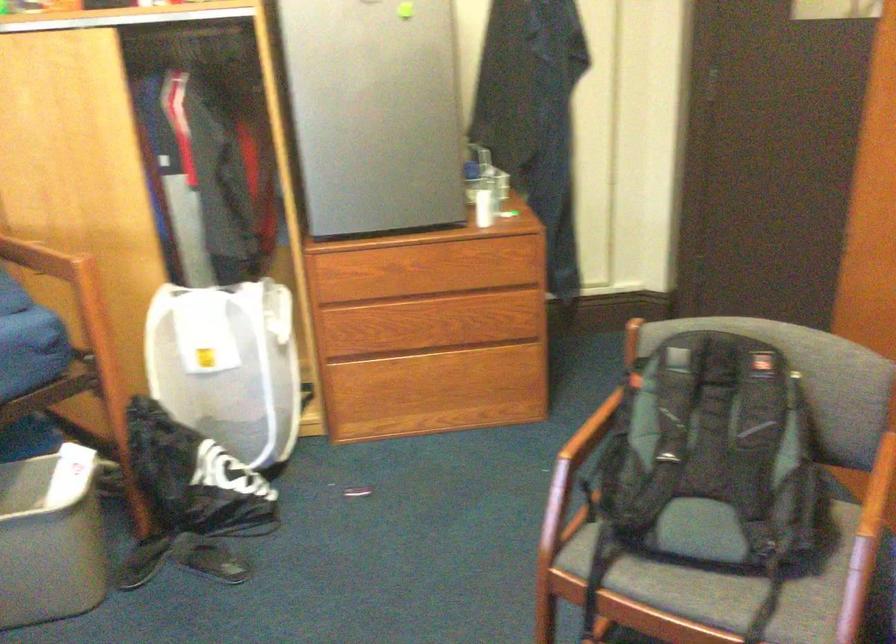
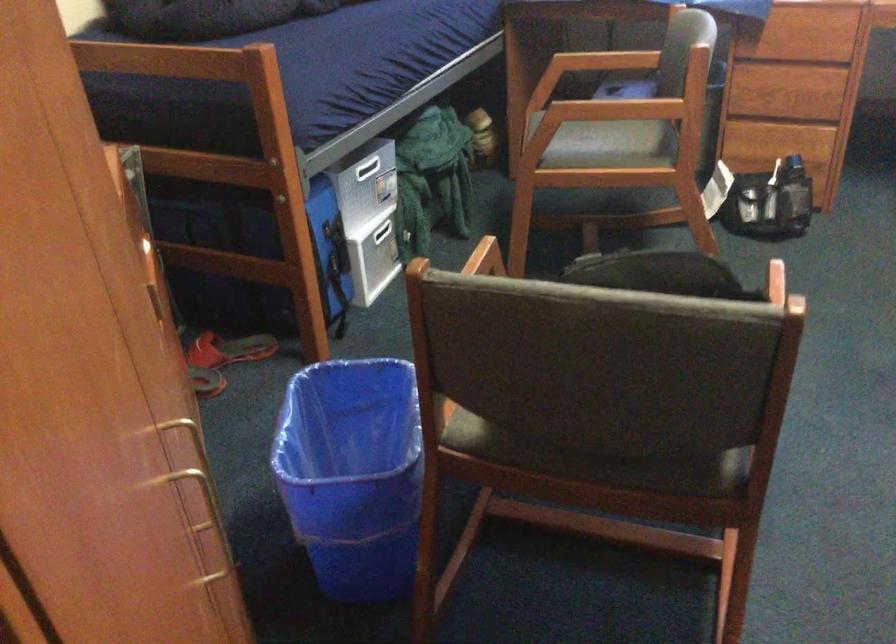
Locate, in the second image, the point that corresponds to point 678,375 in the first image.

(659, 272)